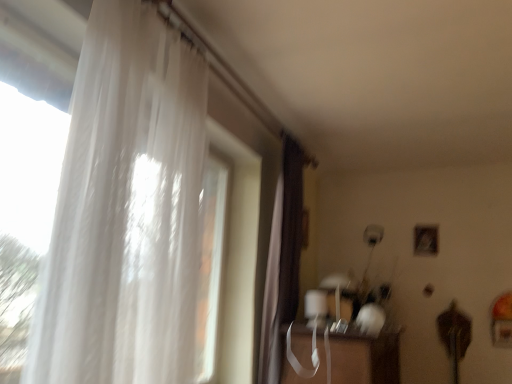
Question: Considering the relative positions of brown velvet curtain at center, which is the 1th curtain in right-to-left order, and translucent white curtain at left, the first curtain when ordered from front to back, in the image provided, is brown velvet curtain at center, which is the 1th curtain in right-to-left order, to the left or to the right of translucent white curtain at left, the first curtain when ordered from front to back,?

Choices:
 (A) right
 (B) left

Answer: (A)

Question: From a real-world perspective, relative to translucent white curtain at left, marked as the first curtain in a left-to-right arrangement, is brown velvet curtain at center, positioned as the 2th curtain in front-to-back order, vertically above or below?

Choices:
 (A) above
 (B) below

Answer: (B)

Question: Which object is positioned farthest from the brown velvet curtain at center, which is the 1th curtain in right-to-left order?

Choices:
 (A) translucent white curtain at left, the 2th curtain when ordered from right to left
 (B) transparent plastic table at lower center

Answer: (A)

Question: Considering the real-world distances, which object is closest to the brown velvet curtain at center, arranged as the second curtain when viewed from the left?

Choices:
 (A) translucent white curtain at left, marked as the first curtain in a left-to-right arrangement
 (B) transparent plastic table at lower center

Answer: (B)